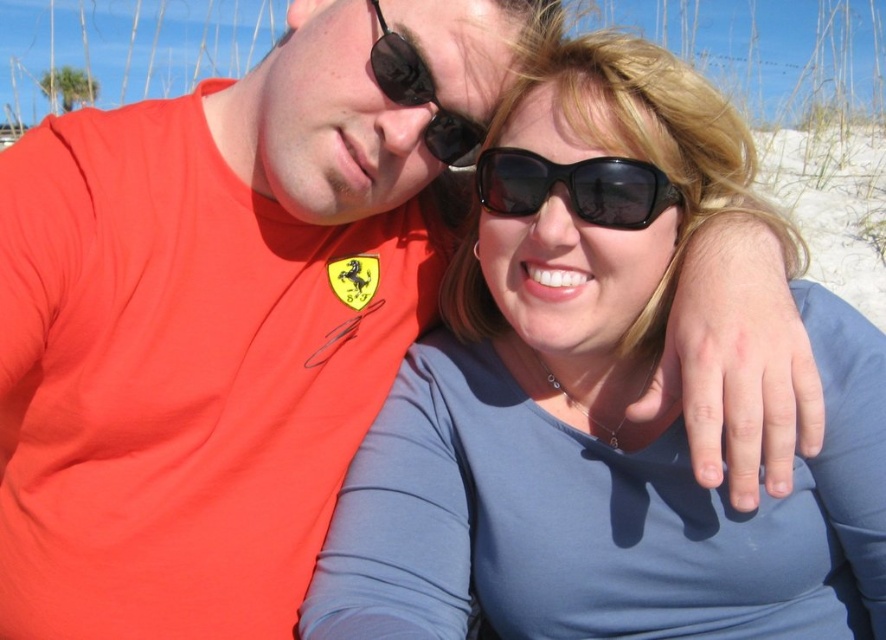
Question: Can you confirm if black plastic sunglasses at center is positioned to the left of black rubber sunglasses at upper center?

Choices:
 (A) no
 (B) yes

Answer: (A)

Question: Which of these objects is positioned closest to the black plastic sunglasses at center?

Choices:
 (A) matte blue shirt at center
 (B) black rubber sunglasses at upper center

Answer: (B)

Question: Can you confirm if matte blue shirt at center is wider than black rubber sunglasses at upper center?

Choices:
 (A) no
 (B) yes

Answer: (B)

Question: Which object appears farthest from the camera in this image?

Choices:
 (A) matte blue shirt at center
 (B) black rubber sunglasses at upper center
 (C) black plastic sunglasses at center

Answer: (B)

Question: Which point is closer to the camera?

Choices:
 (A) (525, 212)
 (B) (444, 116)
 (C) (455, 445)

Answer: (A)

Question: Does matte blue shirt at center appear on the left side of black plastic sunglasses at center?

Choices:
 (A) no
 (B) yes

Answer: (A)